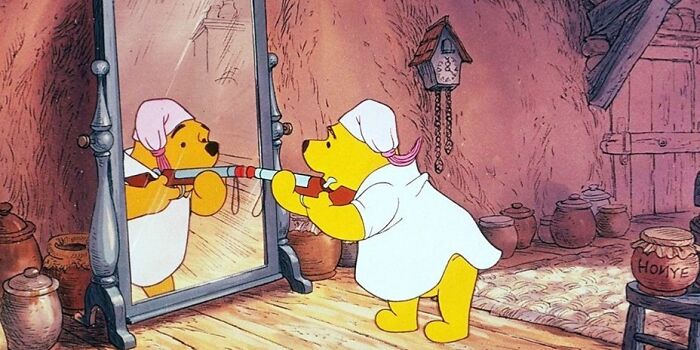
Where is `wood floor`? wood floor is located at coordinates (269, 336).